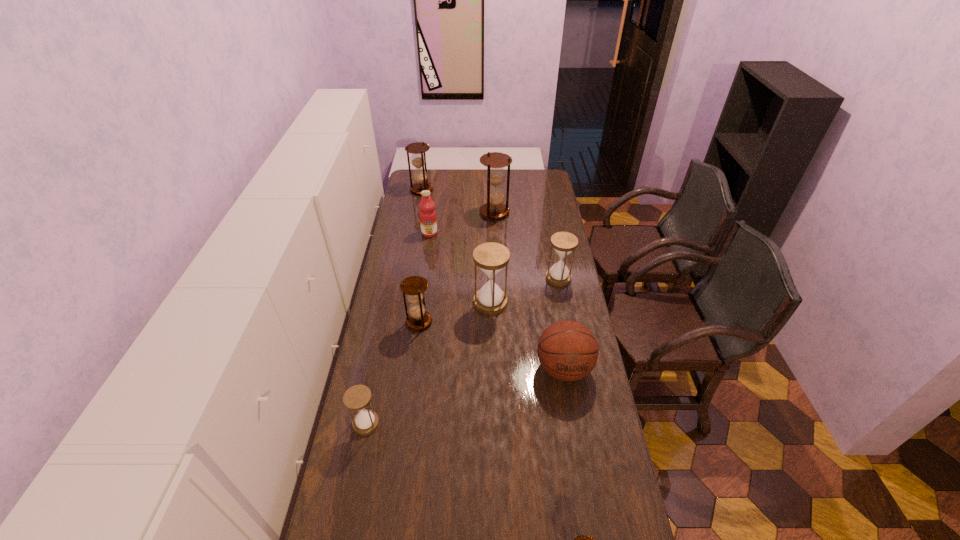
Where is `free space at the right edge`? free space at the right edge is located at coordinates (591, 423).

Where is `vacant space that's between the biggest white hourglass and the pink fruit juice`? vacant space that's between the biggest white hourglass and the pink fruit juice is located at coordinates (460, 268).

At what (x,y) coordinates should I click in order to perform the action: click on free space between the third biggest brown hourglass and the basketball. Please return your answer as a coordinate pair (x, y). This screenshot has width=960, height=540. Looking at the image, I should click on [x=492, y=345].

Find the location of a particular element. empty space between the basketball and the second white hourglass from right to left is located at coordinates (527, 335).

Find the location of `free space between the fruit juice and the biggest white hourglass`. free space between the fruit juice and the biggest white hourglass is located at coordinates (460, 268).

Where is `the third closest object to the smallest white hourglass`? The image size is (960, 540). the third closest object to the smallest white hourglass is located at coordinates (567, 350).

Locate which object ranks seventh in proximity to the biggest white hourglass. Please provide its 2D coordinates. Your answer should be formatted as a tuple, i.e. [(x, y)], where the tuple contains the x and y coordinates of a point satisfying the conditions above.

[(418, 158)]

Select which hourglass is the sixth closest to the third farthest hourglass. Please provide its 2D coordinates. Your answer should be formatted as a tuple, i.e. [(x, y)], where the tuple contains the x and y coordinates of a point satisfying the conditions above.

[(583, 539)]

The image size is (960, 540). What are the coordinates of `hourglass that is the second nearest to the second smallest brown hourglass` in the screenshot? It's located at (358, 397).

Locate which brown hourglass ranks in proximity to the biggest white hourglass. Please provide its 2D coordinates. Your answer should be formatted as a tuple, i.e. [(x, y)], where the tuple contains the x and y coordinates of a point satisfying the conditions above.

[(414, 286)]